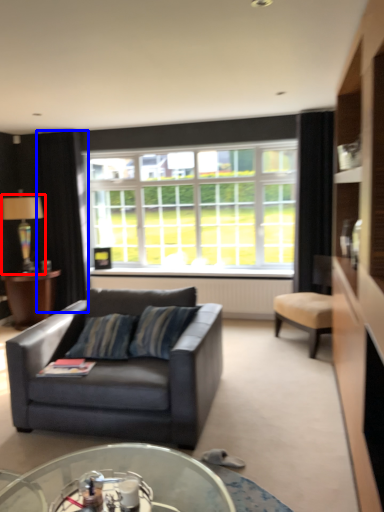
Question: Which of the following is the closest to the observer, lamp (highlighted by a red box) or curtain (highlighted by a blue box)?

Choices:
 (A) lamp
 (B) curtain

Answer: (A)